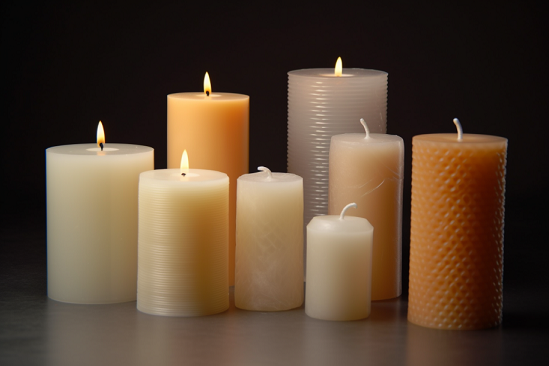
The height and width of the screenshot is (366, 549). I want to click on unlit candles, so (276, 218), (355, 145), (332, 274), (469, 209).